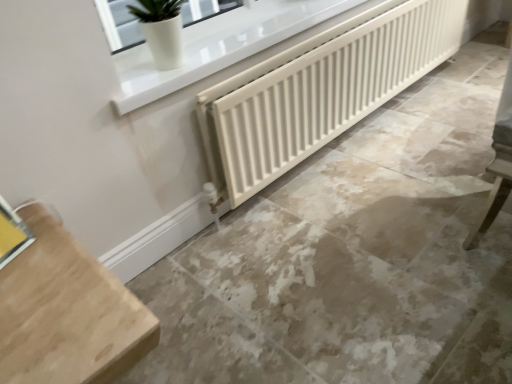
Question: Is there a large distance between beige marble floor at center and white matte radiator at center?

Choices:
 (A) yes
 (B) no

Answer: (B)

Question: Can you confirm if beige marble floor at center is positioned to the right of white matte radiator at center?

Choices:
 (A) yes
 (B) no

Answer: (A)

Question: Can you confirm if beige marble floor at center is thinner than white matte radiator at center?

Choices:
 (A) no
 (B) yes

Answer: (A)

Question: Is beige marble floor at center directly adjacent to white matte radiator at center?

Choices:
 (A) no
 (B) yes

Answer: (A)

Question: Is beige marble floor at center looking in the opposite direction of white matte radiator at center?

Choices:
 (A) no
 (B) yes

Answer: (A)

Question: In the image, is white matte radiator at center on the left side or the right side of light wood table at lower left?

Choices:
 (A) left
 (B) right

Answer: (B)

Question: Considering the positions of white matte radiator at center and light wood table at lower left in the image, is white matte radiator at center taller or shorter than light wood table at lower left?

Choices:
 (A) tall
 (B) short

Answer: (B)

Question: Is white matte radiator at center situated inside light wood table at lower left or outside?

Choices:
 (A) inside
 (B) outside

Answer: (B)

Question: Considering the positions of white matte radiator at center and light wood table at lower left in the image, is white matte radiator at center wider or thinner than light wood table at lower left?

Choices:
 (A) thin
 (B) wide

Answer: (A)

Question: Is light wood table at lower left wider or thinner than beige marble floor at center?

Choices:
 (A) thin
 (B) wide

Answer: (A)

Question: Considering the positions of point (30, 294) and point (146, 281), is point (30, 294) closer or farther from the camera than point (146, 281)?

Choices:
 (A) closer
 (B) farther

Answer: (A)

Question: From a real-world perspective, is light wood table at lower left physically located above or below beige marble floor at center?

Choices:
 (A) below
 (B) above

Answer: (B)

Question: Do you think light wood table at lower left is within beige marble floor at center, or outside of it?

Choices:
 (A) inside
 (B) outside

Answer: (B)

Question: In the image, is light wood table at lower left on the left side or the right side of white matte radiator at center?

Choices:
 (A) right
 (B) left

Answer: (B)

Question: Considering the positions of light wood table at lower left and white matte radiator at center in the image, is light wood table at lower left bigger or smaller than white matte radiator at center?

Choices:
 (A) small
 (B) big

Answer: (B)